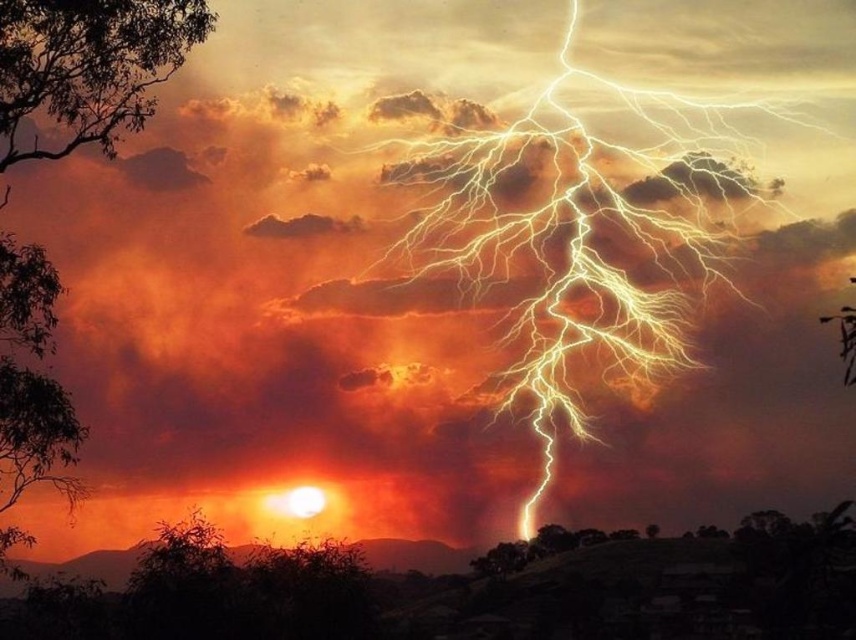
You are standing in the scene and want to walk from the green leafy tree at upper left to the green leafy tree at left. Which direction should you move to get from the closer tree to the farther one?

The green leafy tree at upper left is closer to the viewer. To reach the green leafy tree at left, which is farther away, you should move backward away from the current position.

You are an observer looking at the sunset scene with the lightning strike. You notice two trees in the foreground. Which tree is positioned lower in the image, the silhouette bark tree at left or the green leafy tree at upper left?

The silhouette bark tree at left is located below the green leafy tree at upper left, so it is positioned lower in the image.